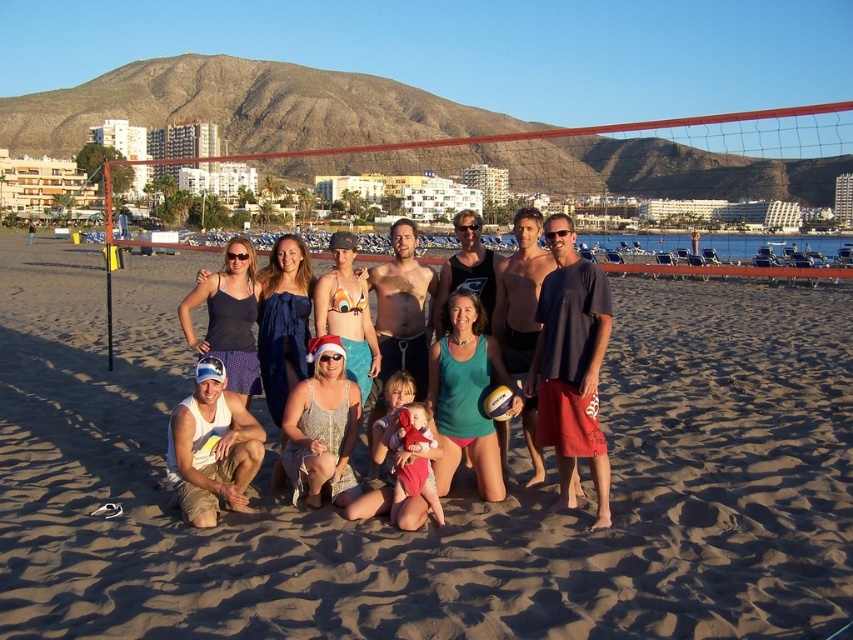
Can you confirm if sandy beach at center is positioned above white tank top at lower left?

Indeed, sandy beach at center is positioned over white tank top at lower left.

Between point (590, 620) and point (212, 426), which one is positioned behind?

Point (212, 426)

In order to click on sandy beach at center in this screenshot , I will do `click(450, 496)`.

Does white tank top at lower left have a greater height compared to yellow rubber volleyball at center?

Yes.

Who is positioned more to the right, white tank top at lower left or yellow rubber volleyball at center?

yellow rubber volleyball at center

Is point (225, 378) farther from camera compared to point (495, 388)?

No, (225, 378) is in front of (495, 388).

Locate an element on the screen. Image resolution: width=853 pixels, height=640 pixels. white tank top at lower left is located at coordinates (212, 448).

Is matte black volleyball at center thinner than white tank top at lower left?

Incorrect, matte black volleyball at center's width is not less than white tank top at lower left's.

Between point (532, 308) and point (253, 440), which one is positioned behind?

The point (532, 308) is more distant.

Does point (425, 515) lie in front of point (173, 476)?

That is True.

Identify the location of matte black volleyball at center. The width and height of the screenshot is (853, 640). (473, 465).